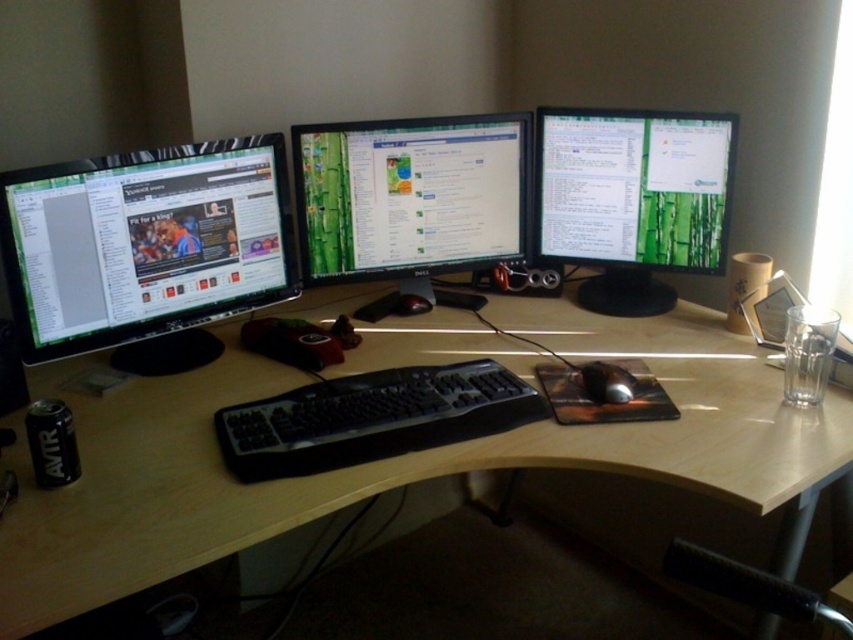
You are a delivery robot approaching the desk from the front. You need to place a package at point [670,436] and point [602,392]. Which point should you reach first?

Point [670,436] is in front of point [602,392], so you should reach point [670,436] first since it is closer to you when approaching from the front.

You are a person with a height of 1.7 meters standing in front of the light wood computer desk at center. Can you see the black rubber mouse at center without bending down?

The light wood computer desk at center is taller than the black rubber mouse at center, so yes, you can see the black rubber mouse at center without bending down because it is placed on the desk surface which is at a standard height for someone of your height.

You are setting up a new monitor and need to know which existing monitor is bigger to decide placement. Which is larger between the matte black monitor at left and the matte black monitor at center right?

The matte black monitor at left is larger than the matte black monitor at center right according to the description.